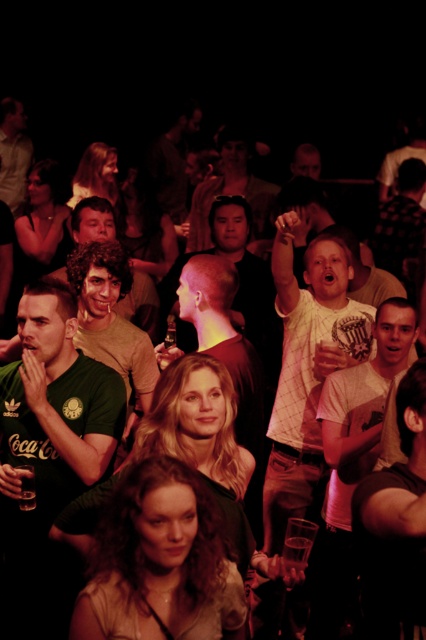
Question: Which point appears closest to the camera in this image?

Choices:
 (A) (308, 436)
 (B) (176, 321)

Answer: (A)

Question: From the image, what is the correct spatial relationship of flannel shirt at center in relation to matte green t-shirt at left?

Choices:
 (A) right
 (B) left

Answer: (A)

Question: Can you confirm if white t-shirt at center is smaller than matte brown shirt at upper left?

Choices:
 (A) yes
 (B) no

Answer: (B)

Question: Considering the real-world distances, which object is closest to the shiny silver hair at center?

Choices:
 (A) matte brown shirt at upper left
 (B) white t-shirt at center

Answer: (B)

Question: Can you confirm if smooth skin head at center is bigger than dark brown leather jacket at center?

Choices:
 (A) no
 (B) yes

Answer: (B)

Question: Among these objects, which one is farthest from the camera?

Choices:
 (A) dark brown leather jacket at center
 (B) green matte shirt at center
 (C) green matte shirt at left
 (D) smooth skin face at center

Answer: (A)